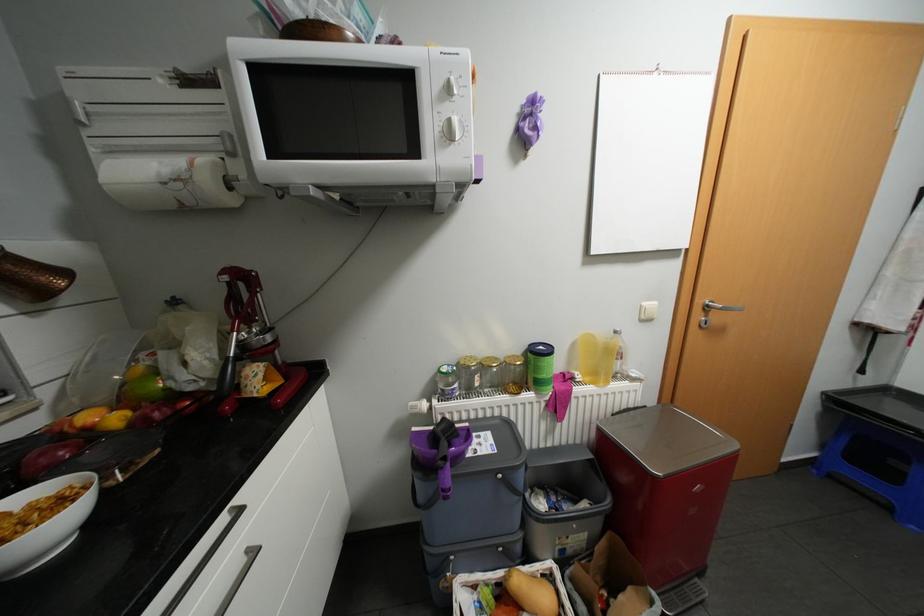
You are a GUI agent. You are given a task and a screenshot of the screen. Output one action in this format:
    pyautogui.click(x=<x>, y=<y>)
    Task: Click on the paper towel roll
    
    Given the screenshot: What is the action you would take?
    pyautogui.click(x=166, y=182)